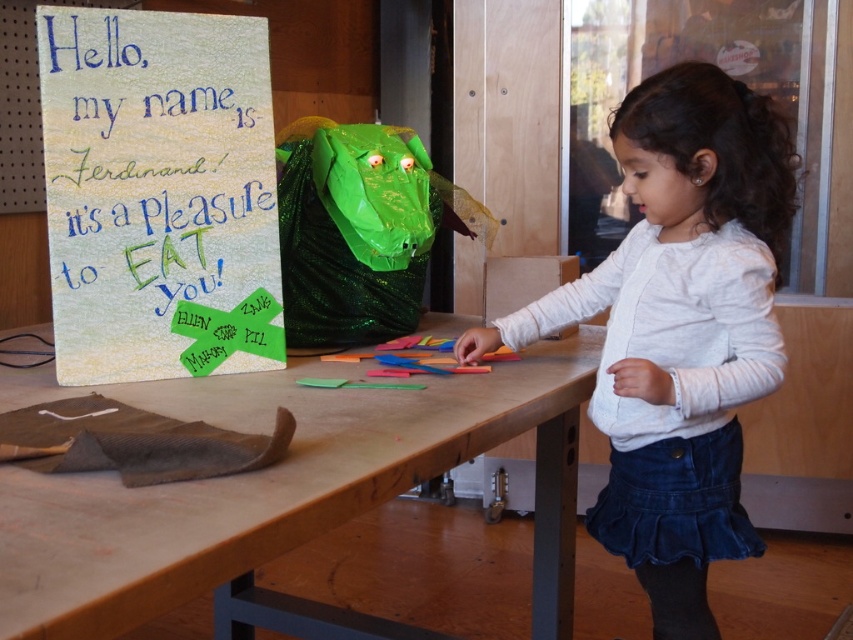
Based on the photo, is wooden table at center below white soft sweater at center?

Correct, wooden table at center is located below white soft sweater at center.

Does wooden table at center appear on the left side of white soft sweater at center?

Indeed, wooden table at center is positioned on the left side of white soft sweater at center.

Who is more forward, (165, 564) or (648, 236)?

Point (165, 564) is in front.

Find the location of a particular element. wooden table at center is located at coordinates (277, 490).

Is wooden table at center below textured paper sign at upper left?

Yes, wooden table at center is below textured paper sign at upper left.

From the picture: Does wooden table at center appear on the left side of textured paper sign at upper left?

No, wooden table at center is not to the left of textured paper sign at upper left.

From the picture: Who is more distant from viewer, (572,540) or (155,49)?

The point (572,540) is more distant.

In order to click on wooden table at center in this screenshot , I will do `click(277, 490)`.

Can you confirm if white soft sweater at center is bigger than textured paper sign at upper left?

Correct, white soft sweater at center is larger in size than textured paper sign at upper left.

Does white soft sweater at center appear on the right side of textured paper sign at upper left?

Yes, white soft sweater at center is to the right of textured paper sign at upper left.

In order to click on white soft sweater at center in this screenshot , I will do `click(679, 330)`.